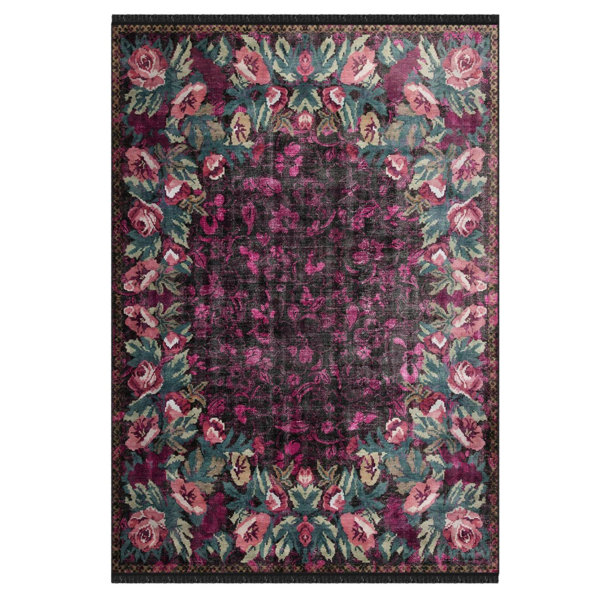
Where is `decorative border`? The width and height of the screenshot is (600, 600). decorative border is located at coordinates (190, 570), (114, 370), (493, 325), (258, 30).